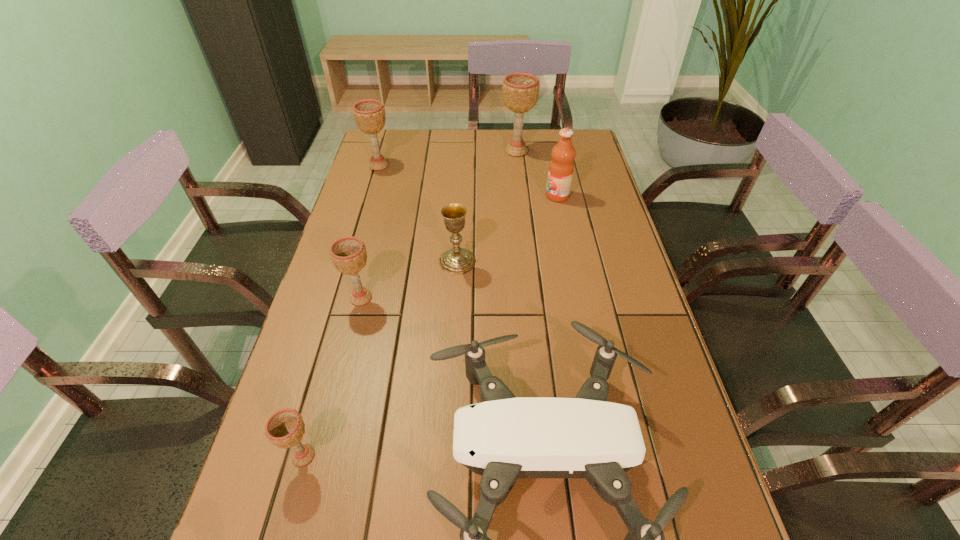
The height and width of the screenshot is (540, 960). Identify the location of free space located 0.250m on the front of the rightmost beige chalice. (522, 201).

At what (x,y) coordinates should I click in order to perform the action: click on free space located 0.160m on the front label of the fruit juice. Please return your answer as a coordinate pair (x, y). Looking at the image, I should click on (497, 196).

Locate an element on the screen. The height and width of the screenshot is (540, 960). free location located 0.330m on the front label of the fruit juice is located at coordinates (446, 196).

Where is `vacant area located on the front label of the fruit juice`? This screenshot has height=540, width=960. vacant area located on the front label of the fruit juice is located at coordinates (452, 196).

Find the location of a particular element. This screenshot has width=960, height=540. vacant space positioned on the front of the third smallest beige chalice is located at coordinates (365, 212).

Find the location of `free location located on the right of the fourth farthest object`. free location located on the right of the fourth farthest object is located at coordinates (497, 261).

Locate an element on the screen. The width and height of the screenshot is (960, 540). vacant region located on the back of the fourth farthest chalice is located at coordinates (368, 270).

At what (x,y) coordinates should I click in order to perform the action: click on free spot located 0.110m on the front of the nearest chalice. Please return your answer as a coordinate pair (x, y). Image resolution: width=960 pixels, height=540 pixels. Looking at the image, I should click on (281, 537).

Locate an element on the screen. This screenshot has width=960, height=540. object that is at the right edge is located at coordinates (561, 167).

Where is `object located at the far left corner`? object located at the far left corner is located at coordinates (369, 115).